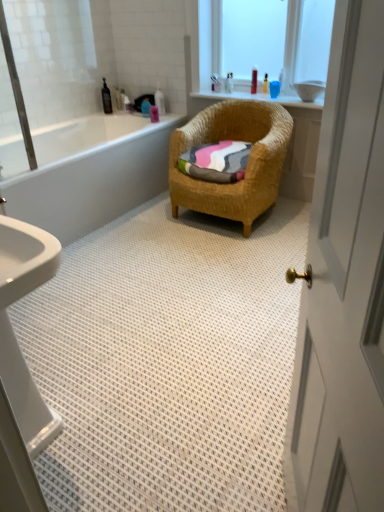
Locate an element on the screen. The height and width of the screenshot is (512, 384). free point in front of translucent plastic bottle at upper center, the sixth toiletry when ordered from left to right is located at coordinates (233, 94).